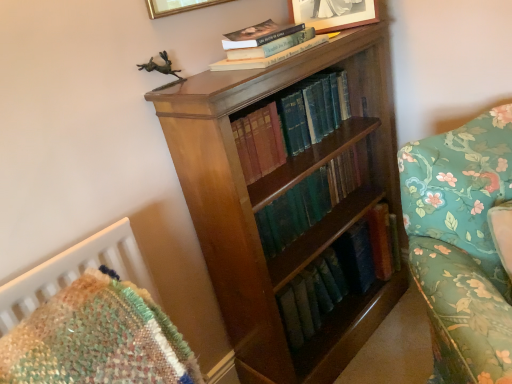
Question: Is point (293, 11) positioned closer to the camera than point (157, 8)?

Choices:
 (A) closer
 (B) farther

Answer: (B)

Question: Would you say matte silver picture frame at upper center, which is the 2th picture frame in left-to-right order, is to the left or to the right of gold metallic picture frame at upper center, arranged as the 1th picture frame when viewed from the left, in the picture?

Choices:
 (A) right
 (B) left

Answer: (A)

Question: Estimate the real-world distances between objects in this image. Which object is closer to the matte silver picture frame at upper center, the 1th picture frame positioned from the right?

Choices:
 (A) green leather book at center, which is counted as the 2th book, starting from the bottom
 (B) gold metallic picture frame at upper center, arranged as the 1th picture frame when viewed from the left
 (C) shiny brown wood bookcase at center
 (D) hardcover book at upper center, marked as the third book in a bottom-to-top arrangement
 (E) floral fabric couch at right

Answer: (D)

Question: Estimate the real-world distances between objects in this image. Which object is farther from the gold metallic picture frame at upper center, the 2th picture frame viewed from the right?

Choices:
 (A) floral fabric couch at right
 (B) green leather book at center, the first book from the bottom
 (C) green leather book at center, the second book when ordered from top to bottom
 (D) matte silver picture frame at upper center, which is the 2th picture frame in left-to-right order
 (E) hardcover book at upper center, which ranks as the first book in top-to-bottom order

Answer: (A)